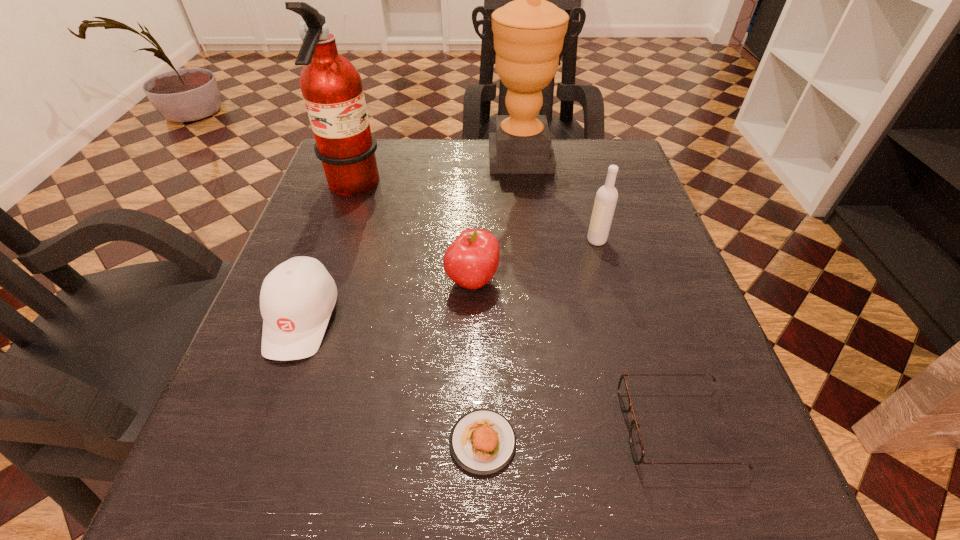
Image resolution: width=960 pixels, height=540 pixels. What are the coordinates of `vacant area that lies between the shortest object and the award` in the screenshot? It's located at (501, 299).

Locate an element on the screen. The width and height of the screenshot is (960, 540). blank region between the third tallest object and the apple is located at coordinates (535, 260).

The width and height of the screenshot is (960, 540). Identify the location of vacant area that lies between the baseball cap and the sunglasses. (489, 373).

You are a GUI agent. You are given a task and a screenshot of the screen. Output one action in this format:
    pyautogui.click(x=<x>, y=<y>)
    Task: Click on the empty space that is in between the award and the vodka
    
    Given the screenshot: What is the action you would take?
    pyautogui.click(x=558, y=198)

Image resolution: width=960 pixels, height=540 pixels. Find the location of `vacant area that lies between the fourth shortest object and the fire extinguisher`. vacant area that lies between the fourth shortest object and the fire extinguisher is located at coordinates (412, 234).

Identify the location of object that stands as the fifth closest to the third shortest object. (636, 445).

Find the location of `object identified as the closest to the shortest object`. object identified as the closest to the shortest object is located at coordinates (636, 445).

Locate an element on the screen. The image size is (960, 540). blank area in the image that satisfies the following two spatial constraints: 1. at the front of the award with handles; 2. on the left side of the third tallest object is located at coordinates (528, 240).

I want to click on vacant space that satisfies the following two spatial constraints: 1. on the nozzle and handle of the vodka; 2. on the right side of the fire extinguisher, so click(x=334, y=240).

This screenshot has width=960, height=540. What are the coordinates of `free space that satisfies the following two spatial constraints: 1. on the front-facing side of the food; 2. on the right side of the fifth tallest object` in the screenshot? It's located at (256, 442).